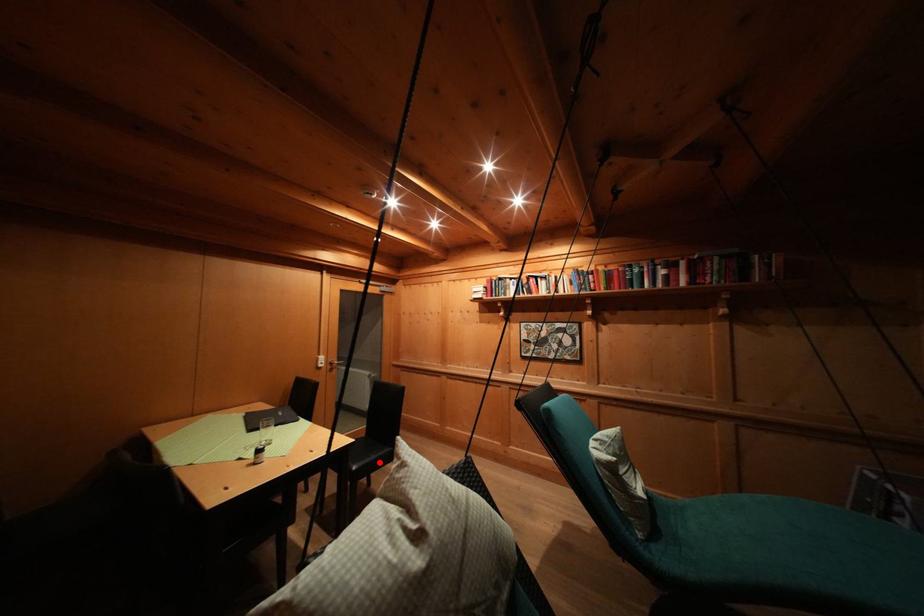
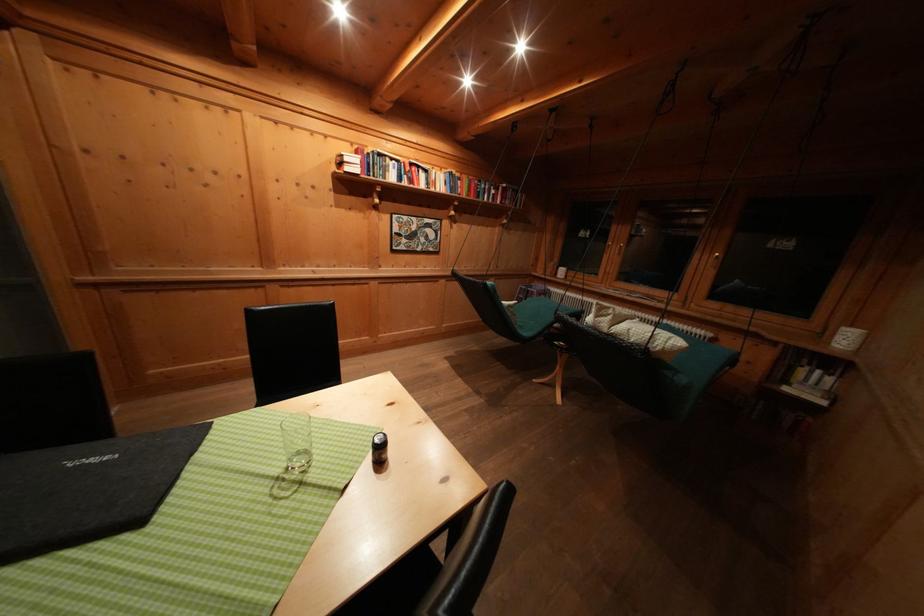
Question: I am providing you with two images of the same scene from different viewpoints. A red point is marked on the first image. Is the red point's position out of view in image 2?

Choices:
 (A) Yes
 (B) No

Answer: (A)